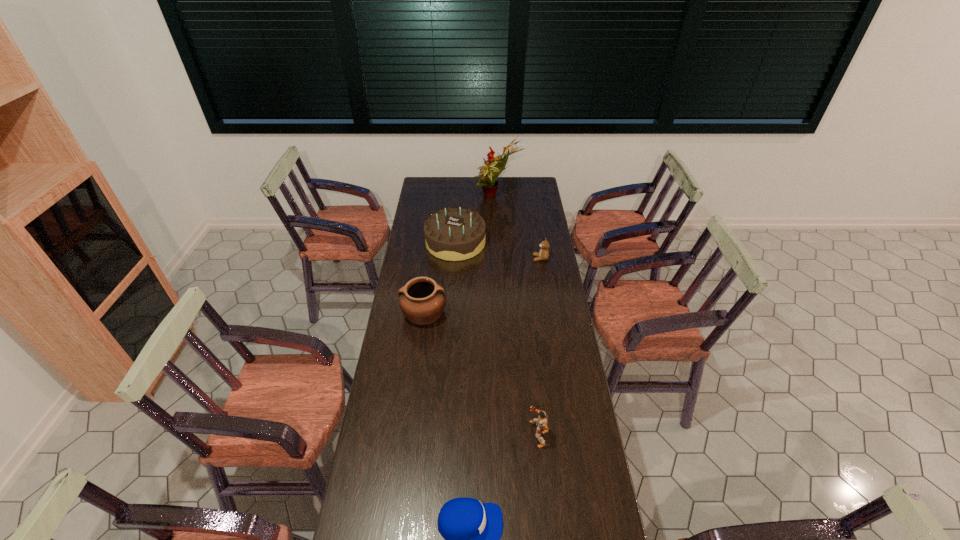
I want to click on the farthest object, so click(494, 166).

The width and height of the screenshot is (960, 540). In order to click on bouquet in this screenshot , I will do `click(494, 166)`.

Find the location of a particular element. birthday cake is located at coordinates (454, 234).

The image size is (960, 540). Find the location of `pottery`. pottery is located at coordinates (422, 300).

Where is `the fifth farthest object`? The image size is (960, 540). the fifth farthest object is located at coordinates (541, 422).

Locate an element on the screen. the fifth tallest object is located at coordinates (543, 254).

Where is `teddy bear`? This screenshot has width=960, height=540. teddy bear is located at coordinates [543, 254].

Identify the location of free spot located on the front-facing side of the farthest object. Image resolution: width=960 pixels, height=540 pixels. (455, 197).

Where is `free region located 0.200m on the front-facing side of the farthest object`? This screenshot has width=960, height=540. free region located 0.200m on the front-facing side of the farthest object is located at coordinates (438, 197).

At what (x,y) coordinates should I click in order to perform the action: click on free space located 0.090m on the front-facing side of the farthest object. Please return your answer as a coordinate pair (x, y). Image resolution: width=960 pixels, height=540 pixels. Looking at the image, I should click on (456, 197).